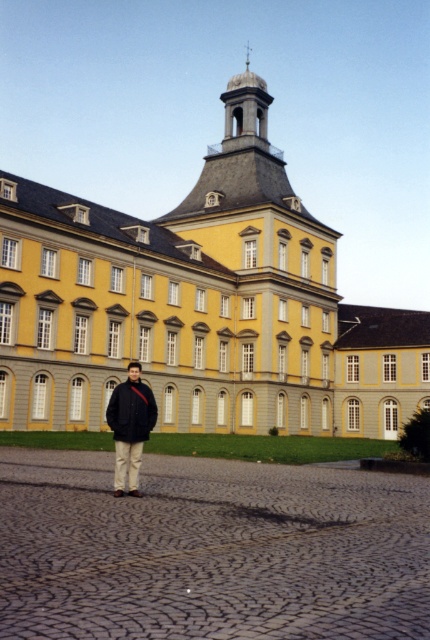
Question: Can you confirm if yellow matte building at center is smaller than dark gray fabric jacket at center?

Choices:
 (A) yes
 (B) no

Answer: (B)

Question: Which point appears farthest from the camera in this image?

Choices:
 (A) click(150, 426)
 (B) click(196, 413)

Answer: (B)

Question: Is dark gray fabric jacket at center smaller than dark blue woolen jacket at center?

Choices:
 (A) yes
 (B) no

Answer: (B)

Question: Does yellow matte building at center have a larger size compared to dark blue woolen jacket at center?

Choices:
 (A) yes
 (B) no

Answer: (A)

Question: Based on their relative distances, which object is nearer to the dark gray fabric jacket at center?

Choices:
 (A) yellow matte building at center
 (B) dark blue woolen jacket at center

Answer: (B)

Question: Which is nearer to the dark blue woolen jacket at center?

Choices:
 (A) dark gray fabric jacket at center
 (B) yellow matte building at center

Answer: (A)